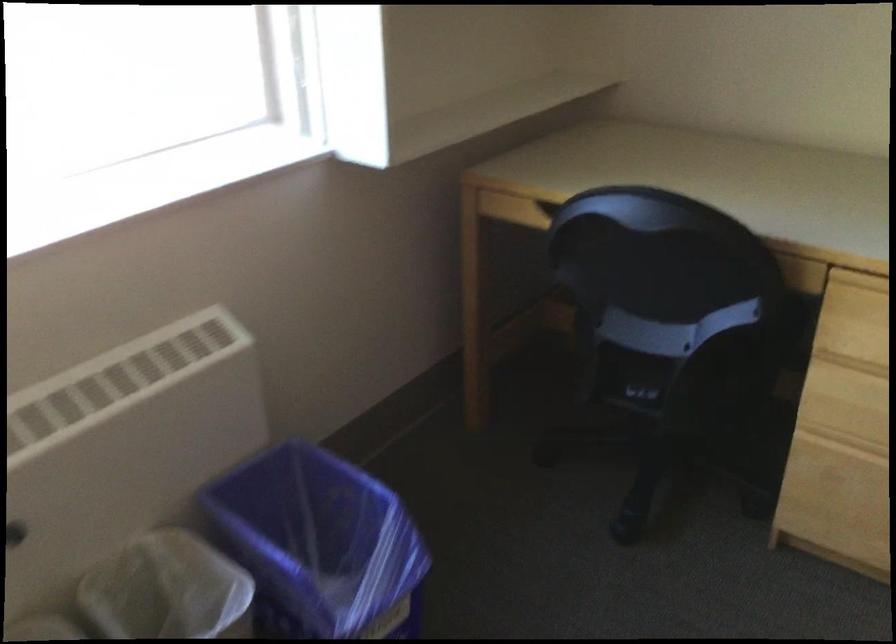
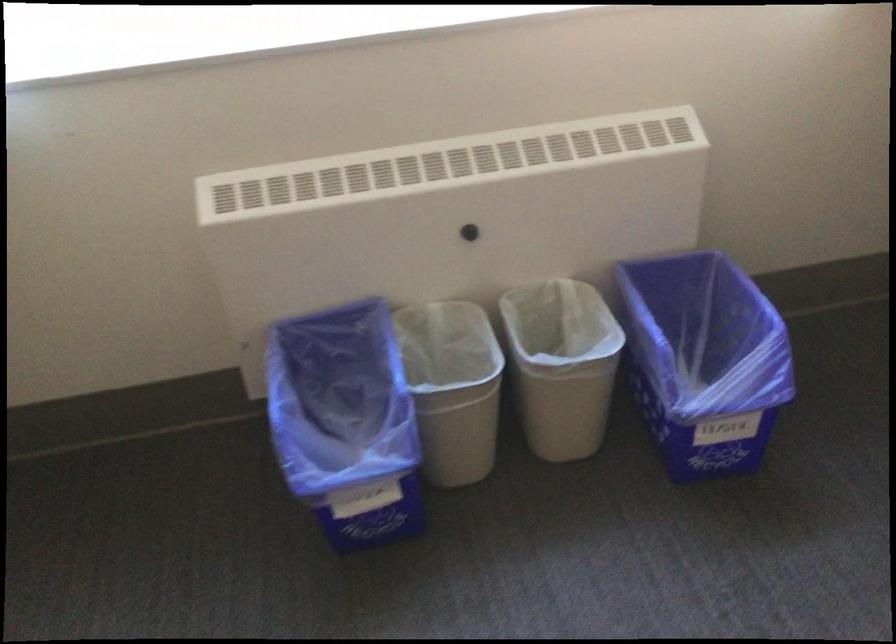
Question: The first image is from the beginning of the video and the second image is from the end. How did the camera likely rotate when shooting the video?

Choices:
 (A) Left
 (B) Right
 (C) Up
 (D) Down

Answer: (A)